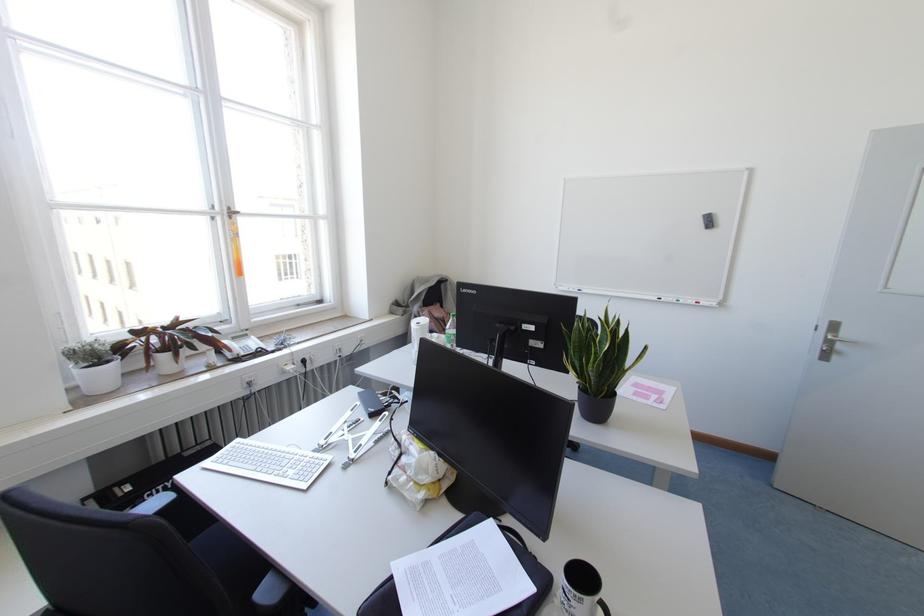
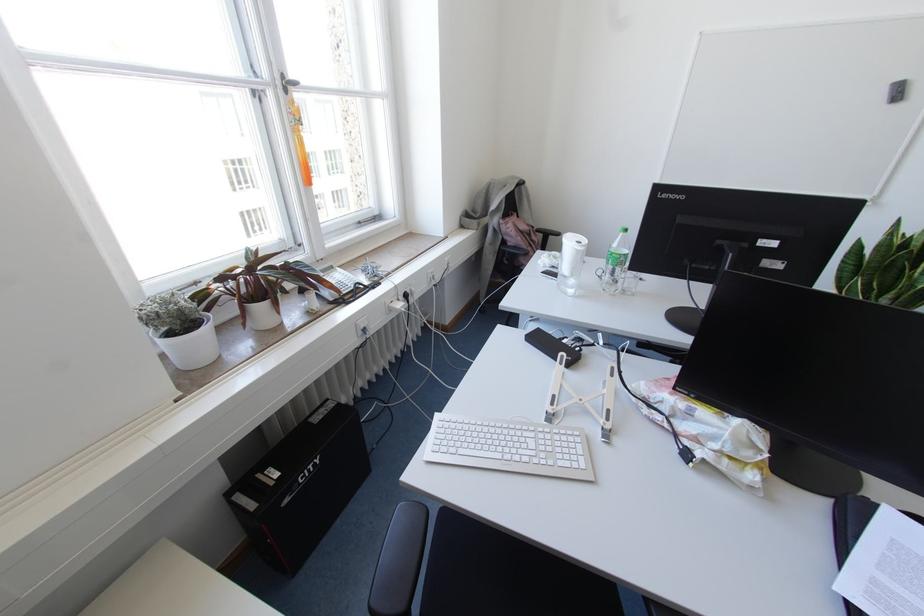
In a continuous first-person perspective shot, in which direction is the camera moving?

The cameraman walked toward left, forward.